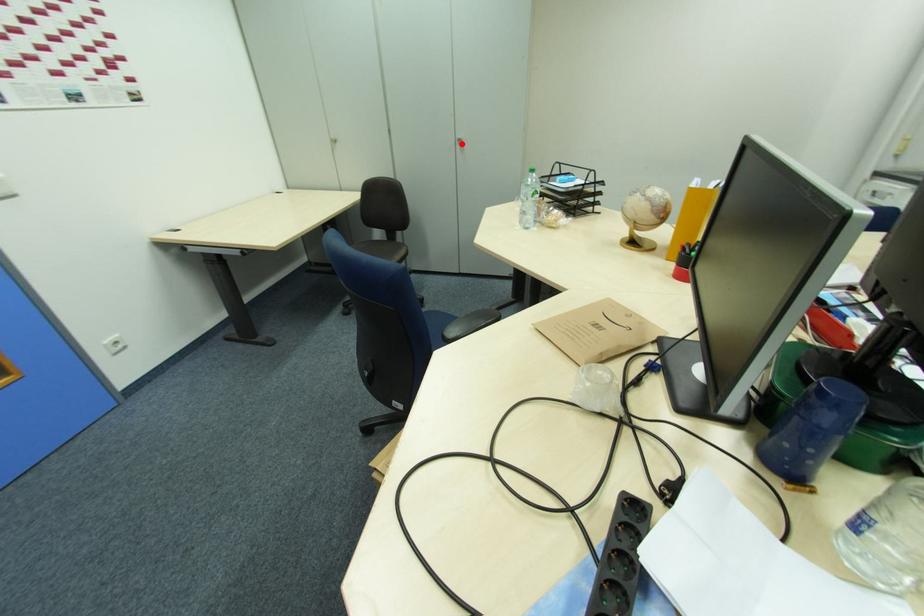
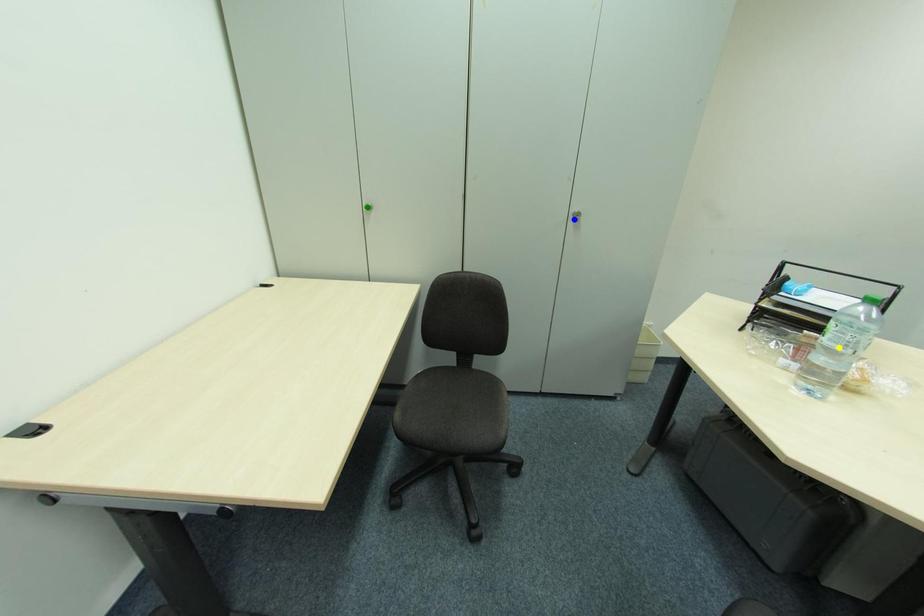
Question: I am providing you with two images of the same scene from different viewpoints. A red point is marked on the first image. You are given multiple points on the second image. Can you choose the point in image 2 that corresponds to the point in image 1?

Choices:
 (A) green point
 (B) blue point
 (C) yellow point

Answer: (B)